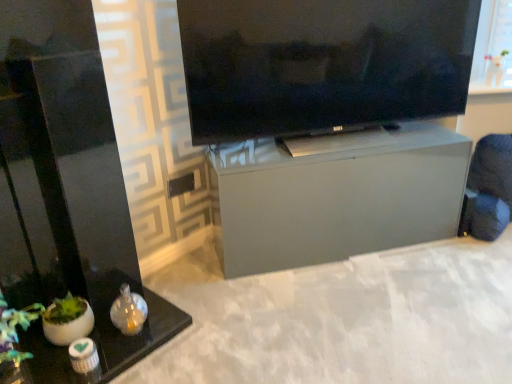
Question: Considering the relative sizes of satin gray cabinet at center, the second furniture from the front, and black glass table at lower left, marked as the 2th furniture in a back-to-front arrangement, in the image provided, is satin gray cabinet at center, the second furniture from the front, taller than black glass table at lower left, marked as the 2th furniture in a back-to-front arrangement,?

Choices:
 (A) no
 (B) yes

Answer: (A)

Question: Considering the relative sizes of satin gray cabinet at center, the first furniture when ordered from right to left, and black glass table at lower left, the 2th furniture when ordered from right to left, in the image provided, is satin gray cabinet at center, the first furniture when ordered from right to left, wider than black glass table at lower left, the 2th furniture when ordered from right to left,?

Choices:
 (A) yes
 (B) no

Answer: (B)

Question: Can you confirm if satin gray cabinet at center, the second furniture from the front, is smaller than black glass table at lower left, arranged as the first furniture when viewed from the front?

Choices:
 (A) no
 (B) yes

Answer: (B)

Question: Can you confirm if satin gray cabinet at center, the 1th furniture when ordered from back to front, is shorter than black glass table at lower left, acting as the first furniture starting from the left?

Choices:
 (A) yes
 (B) no

Answer: (A)

Question: Is satin gray cabinet at center, which is the second furniture from left to right, closer to camera compared to black glass table at lower left, acting as the first furniture starting from the left?

Choices:
 (A) yes
 (B) no

Answer: (B)

Question: From a real-world perspective, relative to satin gray cabinet at center, which is the second furniture from left to right, is matte black tv at upper center vertically above or below?

Choices:
 (A) below
 (B) above

Answer: (B)

Question: Is matte black tv at upper center to the left or to the right of satin gray cabinet at center, the second furniture from the front, in the image?

Choices:
 (A) left
 (B) right

Answer: (A)

Question: From their relative heights in the image, would you say matte black tv at upper center is taller or shorter than satin gray cabinet at center, the second furniture from the front?

Choices:
 (A) short
 (B) tall

Answer: (B)

Question: Looking at the image, does matte black tv at upper center seem bigger or smaller compared to satin gray cabinet at center, the second furniture from the front?

Choices:
 (A) small
 (B) big

Answer: (A)

Question: In terms of height, does black glass table at lower left, acting as the first furniture starting from the left, look taller or shorter compared to matte black tv at upper center?

Choices:
 (A) short
 (B) tall

Answer: (B)

Question: From the image's perspective, relative to matte black tv at upper center, is black glass table at lower left, marked as the 2th furniture in a back-to-front arrangement, above or below?

Choices:
 (A) above
 (B) below

Answer: (B)

Question: Is point (74, 195) closer or farther from the camera than point (259, 110)?

Choices:
 (A) farther
 (B) closer

Answer: (B)

Question: Looking at their shapes, would you say black glass table at lower left, marked as the 2th furniture in a back-to-front arrangement, is wider or thinner than matte black tv at upper center?

Choices:
 (A) wide
 (B) thin

Answer: (A)

Question: In terms of size, does satin gray cabinet at center, the second furniture from the front, appear bigger or smaller than black glass table at lower left, acting as the first furniture starting from the left?

Choices:
 (A) big
 (B) small

Answer: (B)

Question: From the image's perspective, relative to black glass table at lower left, marked as the 2th furniture in a back-to-front arrangement, is satin gray cabinet at center, the 1th furniture when ordered from back to front, above or below?

Choices:
 (A) below
 (B) above

Answer: (B)